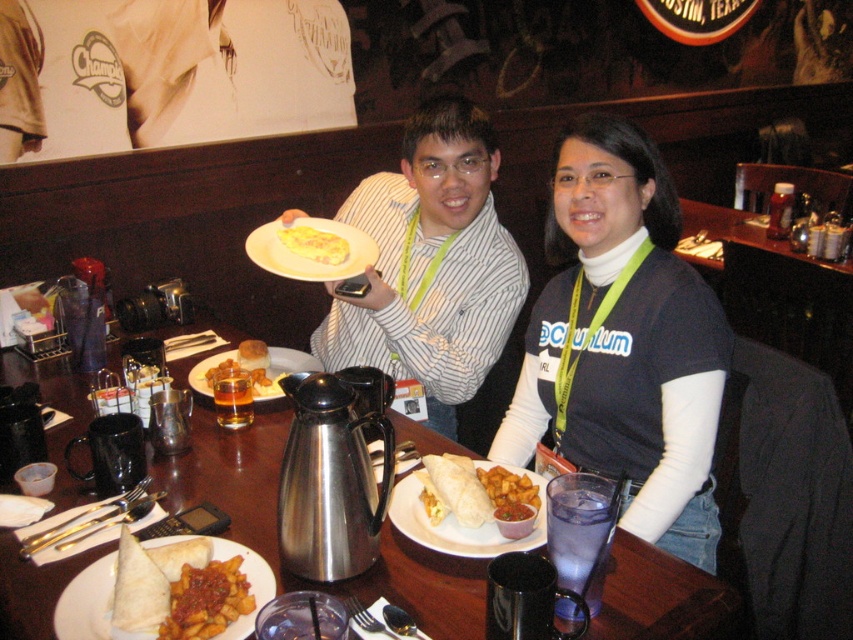
You are a diner sitting at the table and want to reach for the golden crispy fries at center without knocking over the white turtleneck sweater at upper center. Is this possible given their sizes?

The white turtleneck sweater at upper center is taller than the golden crispy fries at center, so it is possible to reach the fries without knocking over the sweater as long as you avoid the taller sweater.

You are a customer at the table and want to pour hot water from the metallic silver thermos at center into the soft tortilla wrap at center. Is the thermos close enough to the wrap to do this without moving either item?

The distance between the metallic silver thermos at center and the soft tortilla wrap at center is 12.93 inches. Since the thermos needs to be very close to the wrap to pour liquid into it, the distance is too far for this action without moving either item.